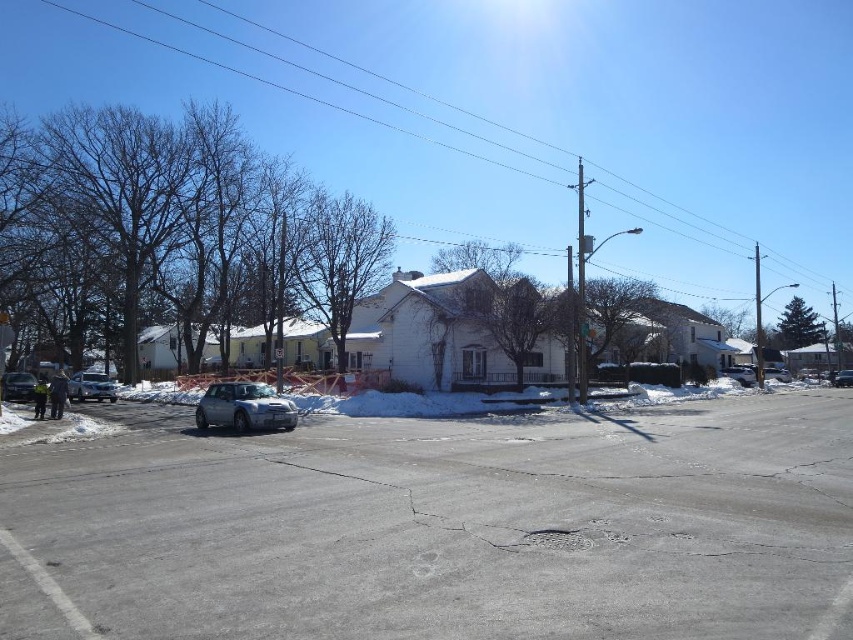
Which of these two, shiny silver sedan at lower left or silver metallic sedan at center-right, stands shorter?

silver metallic sedan at center-right

Does shiny silver sedan at lower left have a greater width compared to silver metallic sedan at center-right?

Yes, shiny silver sedan at lower left is wider than silver metallic sedan at center-right.

Who is more forward, [4,397] or [769,378]?

Positioned in front is point [4,397].

This screenshot has width=853, height=640. I want to click on shiny silver sedan at lower left, so click(x=18, y=387).

Is satin silver car at center taller than silver metallic sedan at left?

In fact, satin silver car at center may be shorter than silver metallic sedan at left.

You are a GUI agent. You are given a task and a screenshot of the screen. Output one action in this format:
    pyautogui.click(x=<x>, y=<y>)
    Task: Click on the satin silver car at center
    
    Given the screenshot: What is the action you would take?
    pyautogui.click(x=244, y=406)

You are a GUI agent. You are given a task and a screenshot of the screen. Output one action in this format:
    pyautogui.click(x=<x>, y=<y>)
    Task: Click on the satin silver car at center
    
    Given the screenshot: What is the action you would take?
    pyautogui.click(x=244, y=406)

Is satin silver sedan at right taller than satin silver sedan at center?

Indeed, satin silver sedan at right has a greater height compared to satin silver sedan at center.

Is point (727, 369) positioned after point (837, 380)?

Yes, it is.

Where is `satin silver sedan at right`? satin silver sedan at right is located at coordinates click(x=741, y=374).